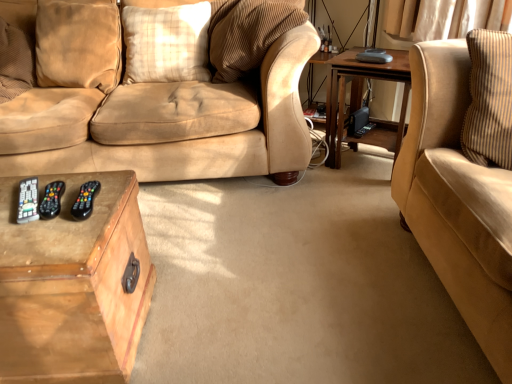
In order to click on free space that is in between wooden trunk at lower left, which is counted as the 1th table, starting from the bottom, and wooden table at right, the 1th table viewed from the back in this screenshot , I will do `click(260, 229)`.